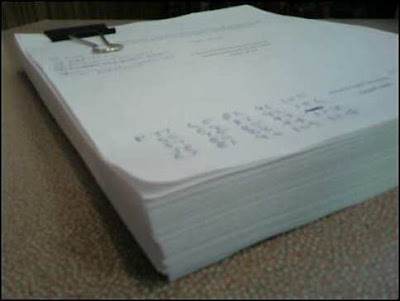
You are a GUI agent. You are given a task and a screenshot of the screen. Output one action in this format:
    pyautogui.click(x=<x>, y=<y>)
    Task: Click on the stack of paper
    This screenshot has width=400, height=301.
    Given the screenshot: What is the action you would take?
    pyautogui.click(x=215, y=63)